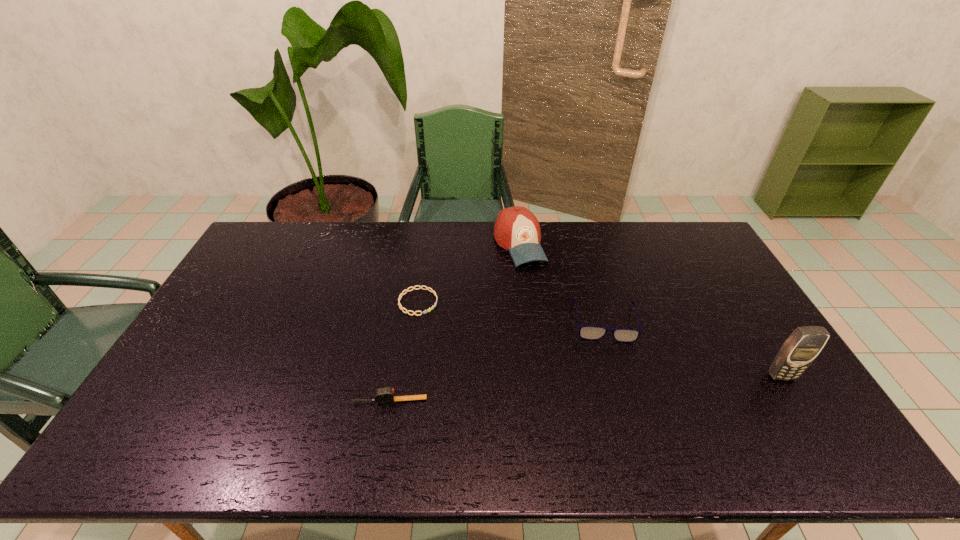
The width and height of the screenshot is (960, 540). Identify the location of vacant space located on the front face of the cellular telephone. (797, 402).

Identify the location of blank area located 0.400m on the front-facing side of the farthest object. (575, 356).

Locate an element on the screen. The width and height of the screenshot is (960, 540). vacant position located on the front-facing side of the farthest object is located at coordinates (537, 283).

Where is `free space located on the front-facing side of the farthest object`? The width and height of the screenshot is (960, 540). free space located on the front-facing side of the farthest object is located at coordinates (548, 305).

At what (x,y) coordinates should I click in order to perform the action: click on vacant region located on the front-facing side of the second object from right to left. Please return your answer as a coordinate pair (x, y). Looking at the image, I should click on (617, 397).

Locate an element on the screen. vacant area situated 0.200m on the front-facing side of the second object from right to left is located at coordinates (618, 404).

The image size is (960, 540). Find the location of `vacant space situated on the front-facing side of the second object from right to left`. vacant space situated on the front-facing side of the second object from right to left is located at coordinates (619, 407).

At what (x,y) coordinates should I click in order to perform the action: click on blank space located 0.390m on the surface of the shortest object showing star-shaped elements. Please return your answer as a coordinate pair (x, y). This screenshot has width=960, height=540. Looking at the image, I should click on (546, 363).

At what (x,y) coordinates should I click in order to perform the action: click on vacant space located 0.360m on the surface of the shortest object showing star-shaped elements. Please return your answer as a coordinate pair (x, y). The image size is (960, 540). Looking at the image, I should click on (537, 358).

You are a GUI agent. You are given a task and a screenshot of the screen. Output one action in this format:
    pyautogui.click(x=<x>, y=<y>)
    Task: Click on the vacant area situated on the surface of the shortest object showing star-shaped elements
    The height and width of the screenshot is (540, 960).
    Given the screenshot: What is the action you would take?
    pyautogui.click(x=503, y=342)